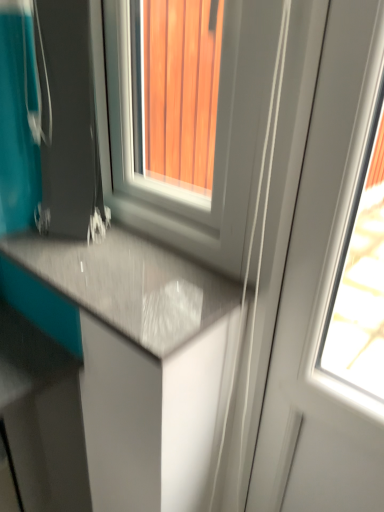
Identify the location of vacant area that is in front of matte black suitcase at lower left. The image size is (384, 512). (97, 265).